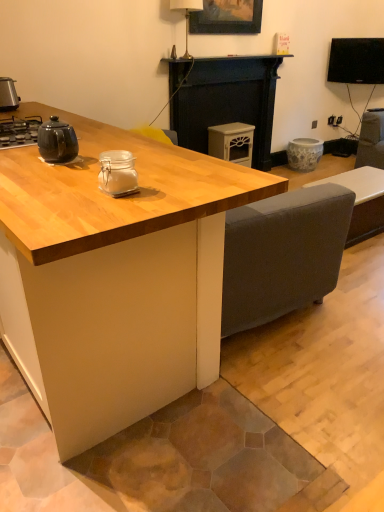
At what (x,y) coordinates should I click in order to perform the action: click on vacant area on the back side of clear glass jar at center, which ranks as the 2th appliance in left-to-right order. Please return your answer as a coordinate pair (x, y). The width and height of the screenshot is (384, 512). Looking at the image, I should click on point(147,172).